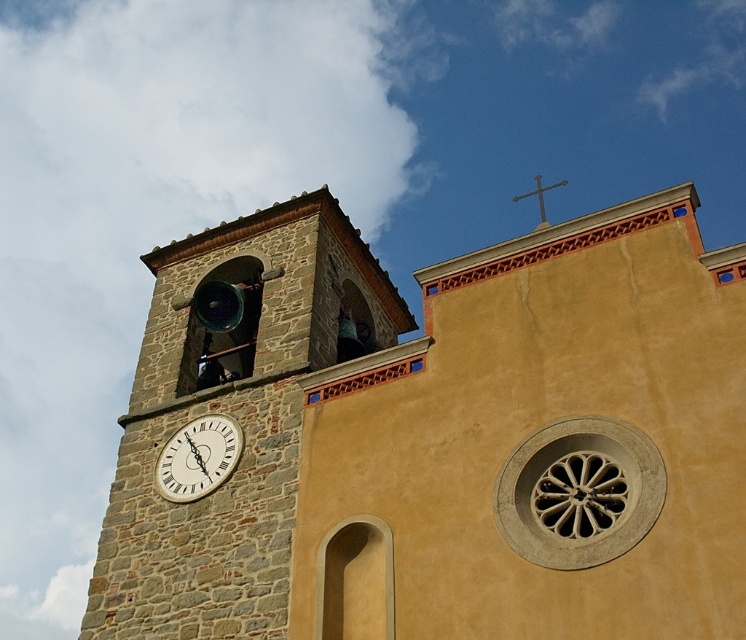
Can you confirm if whitematerial/textureclock at center-left is thinner than metallic cross at upper center?

Indeed, whitematerial/textureclock at center-left has a lesser width compared to metallic cross at upper center.

Who is taller, whitematerial/textureclock at center-left or metallic cross at upper center?

metallic cross at upper center is taller.

Who is more forward, [233,461] or [565,179]?

Point [233,461] is more forward.

At what (x,y) coordinates should I click in order to perform the action: click on whitematerial/textureclock at center-left. Please return your answer as a coordinate pair (x, y). This screenshot has height=640, width=746. Looking at the image, I should click on (198, 458).

Does stone clock tower at upper left have a greater height compared to metallic cross at upper center?

Correct, stone clock tower at upper left is much taller as metallic cross at upper center.

Who is more distant from viewer, (606,300) or (562,184)?

Positioned behind is point (562,184).

Does point (639, 540) lie in front of point (527, 195)?

Yes, point (639, 540) is closer to viewer.

I want to click on stone clock tower at upper left, so tap(438, 436).

Image resolution: width=746 pixels, height=640 pixels. What are the coordinates of `stone clock tower at upper left` in the screenshot? It's located at (438, 436).

Can you confirm if stone clock tower at upper left is shorter than whitematerial/textureclock at center-left?

In fact, stone clock tower at upper left may be taller than whitematerial/textureclock at center-left.

Locate an element on the screen. The height and width of the screenshot is (640, 746). stone clock tower at upper left is located at coordinates (438, 436).